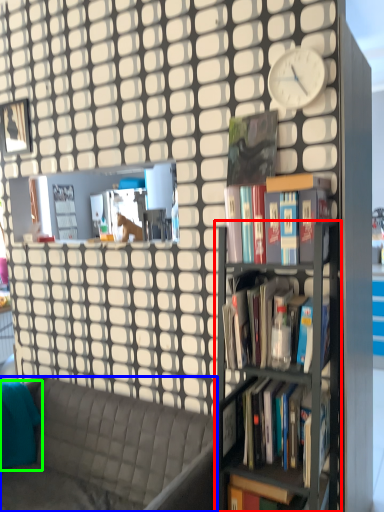
Question: Considering the real-world distances, which object is farthest from bookshelf (highlighted by a red box)? studio couch (highlighted by a blue box) or pillow (highlighted by a green box)?

Choices:
 (A) studio couch
 (B) pillow

Answer: (B)